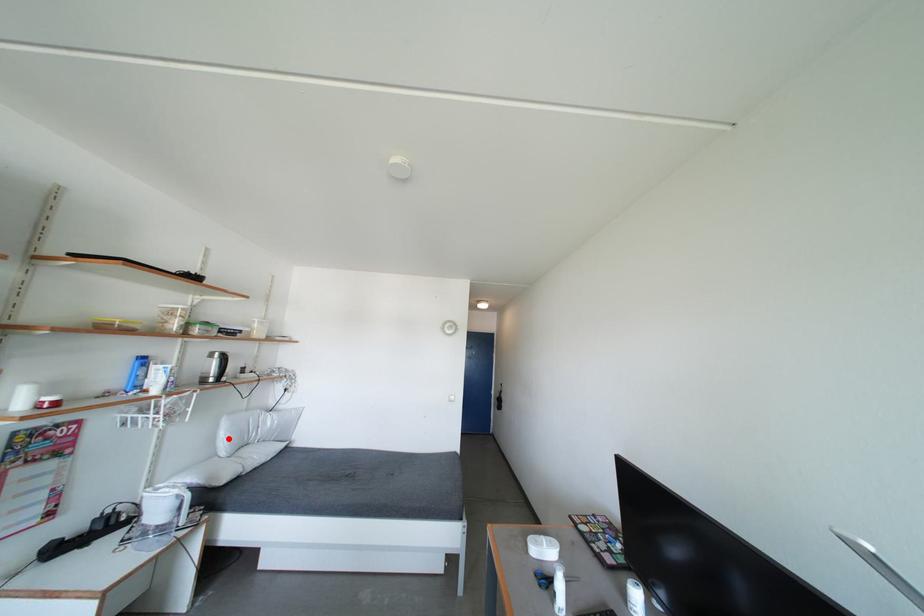
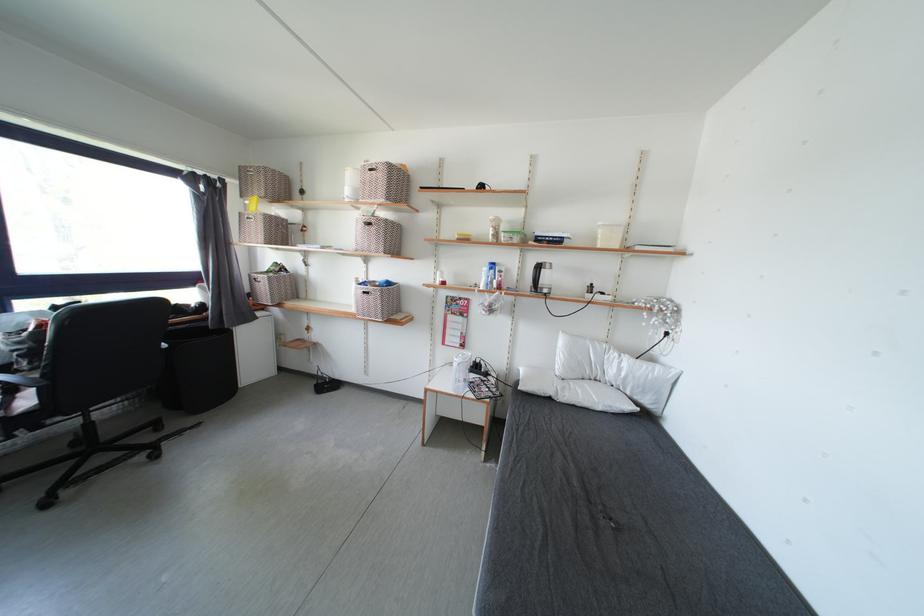
In the second image, find the point that corresponds to the highlighted location in the first image.

(565, 355)